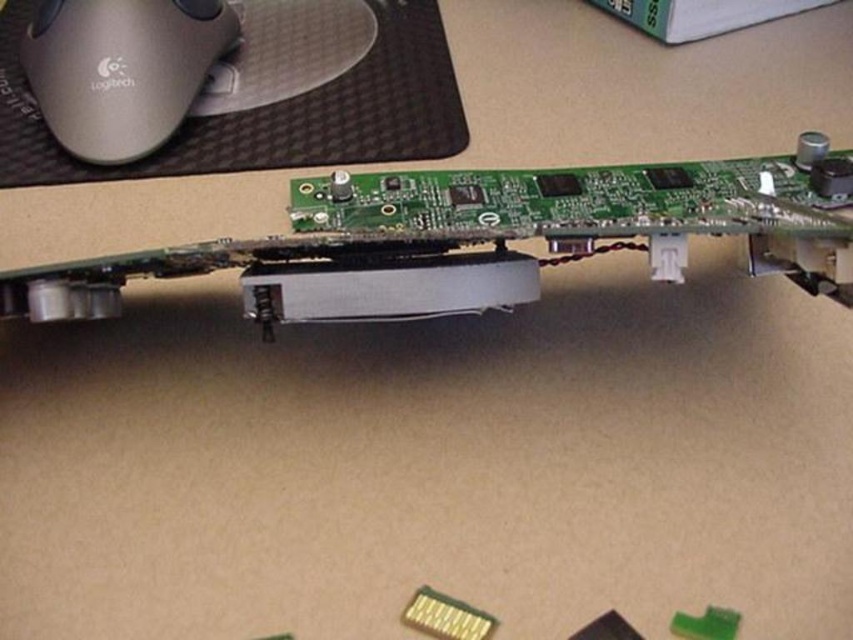
You are setting up a workspace and need to place both the black rubber mousepad at upper center and the matte white mouse at upper left on a desk. Considering their sizes, which object will occupy more vertical space when placed upright?

The black rubber mousepad at upper center is much taller than the matte white mouse at upper left, so it will occupy more vertical space when placed upright.

You are setting up a new laptop on a desk. You see the point at coordinates (271, 113). Where is this point located?

The point at coordinates (271, 113) is on the black rubber mousepad at upper center.

You are setting up a workspace and need to place both the matte white mouse at upper left and the black rubber mousepad at upper center. Based on the image, which object is closer to you?

The black rubber mousepad at upper center is closer to you since the matte white mouse at upper left is behind it.